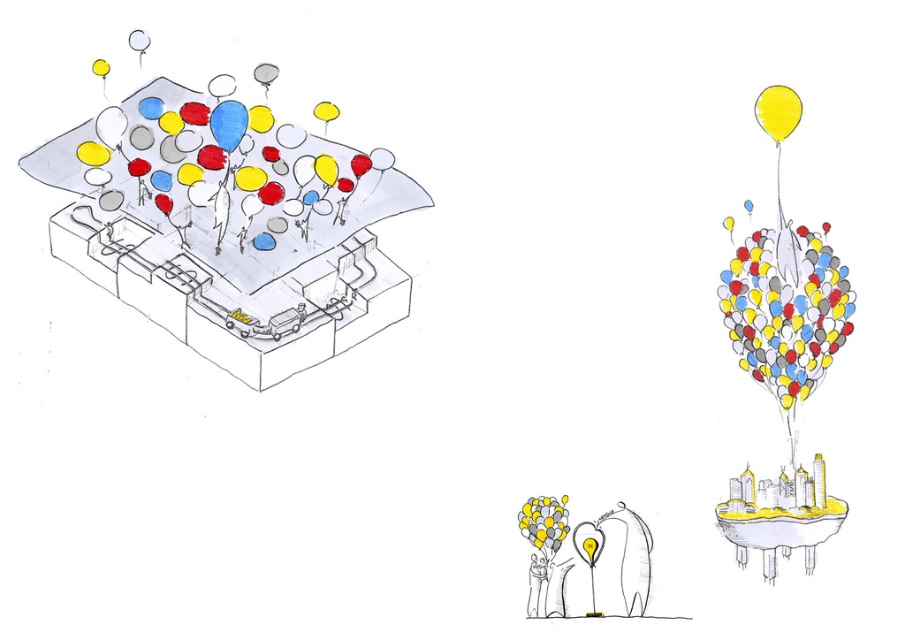
Question: Is matte gray box at center bigger than yellow matte balloon at upper right?

Choices:
 (A) yes
 (B) no

Answer: (A)

Question: Which of the following is the closest to the observer?

Choices:
 (A) (776, 92)
 (B) (167, 305)

Answer: (A)

Question: Is matte gray box at center to the right of yellow matte balloon at upper right from the viewer's perspective?

Choices:
 (A) no
 (B) yes

Answer: (A)

Question: Which point is farther to the camera?

Choices:
 (A) matte gray box at center
 (B) yellow matte balloon at upper right

Answer: (B)

Question: Does matte gray box at center have a greater width compared to yellow matte balloon at upper right?

Choices:
 (A) no
 (B) yes

Answer: (B)